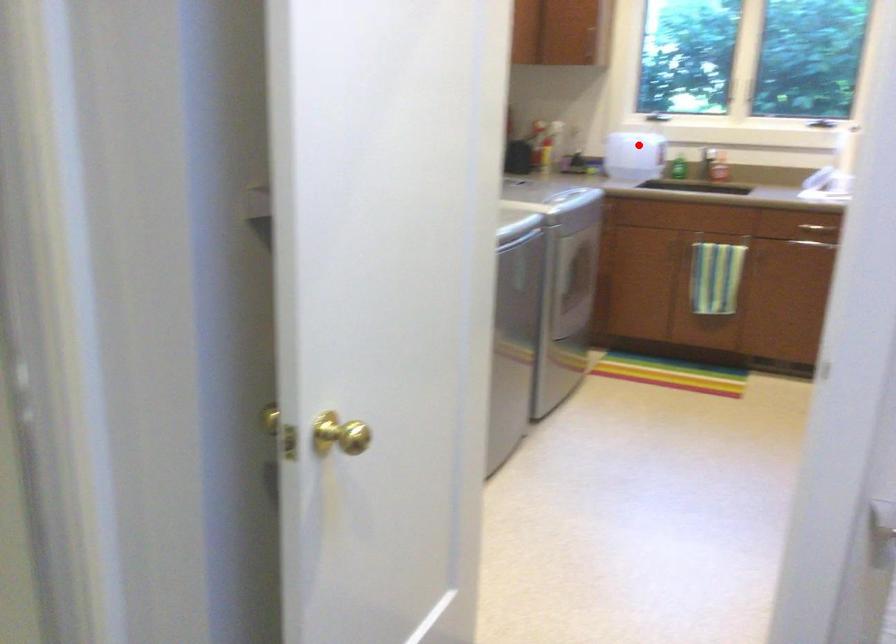
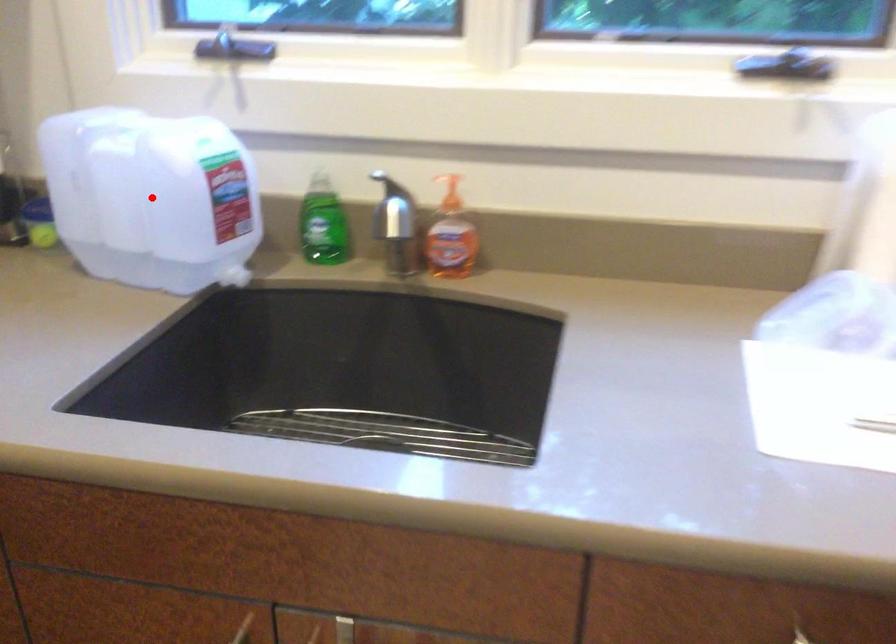
I am providing you with two images of the same scene from different viewpoints. A red point is marked on the first image and another point is marked on the second image. Is the red point in image1 aligned with the point shown in image2?

Yes